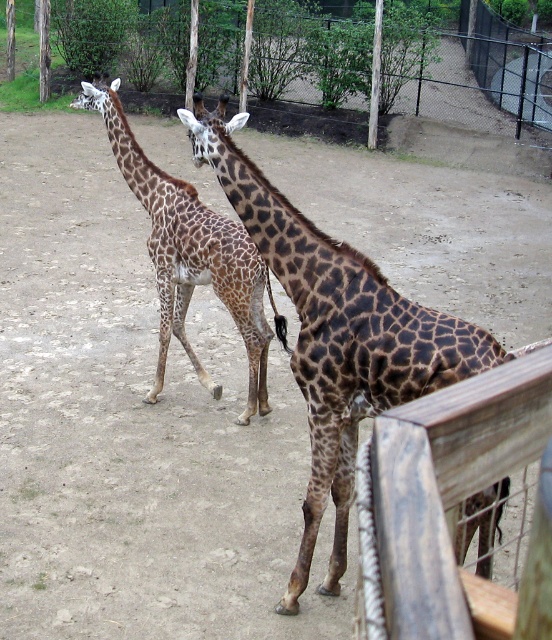
Question: Which point is farther to the camera?

Choices:
 (A) (374, 332)
 (B) (395, 38)
 (C) (188, 193)
 (D) (455, 627)

Answer: (B)

Question: Does spotted fur giraffe at center have a lesser width compared to brown spotted giraffe at center?

Choices:
 (A) no
 (B) yes

Answer: (B)

Question: Among these objects, which one is farthest from the camera?

Choices:
 (A) brown spotted giraffe at center
 (B) wooden fence at upper center
 (C) spotted fur giraffe at center

Answer: (B)

Question: Can you confirm if wooden fence at right is positioned below spotted fur giraffe at center?

Choices:
 (A) yes
 (B) no

Answer: (A)

Question: Does wooden fence at right have a larger size compared to brown spotted giraffe at center?

Choices:
 (A) yes
 (B) no

Answer: (A)

Question: Which object is the farthest from the spotted fur giraffe at center?

Choices:
 (A) wooden fence at upper center
 (B) wooden fence at right
 (C) brown spotted giraffe at center

Answer: (A)